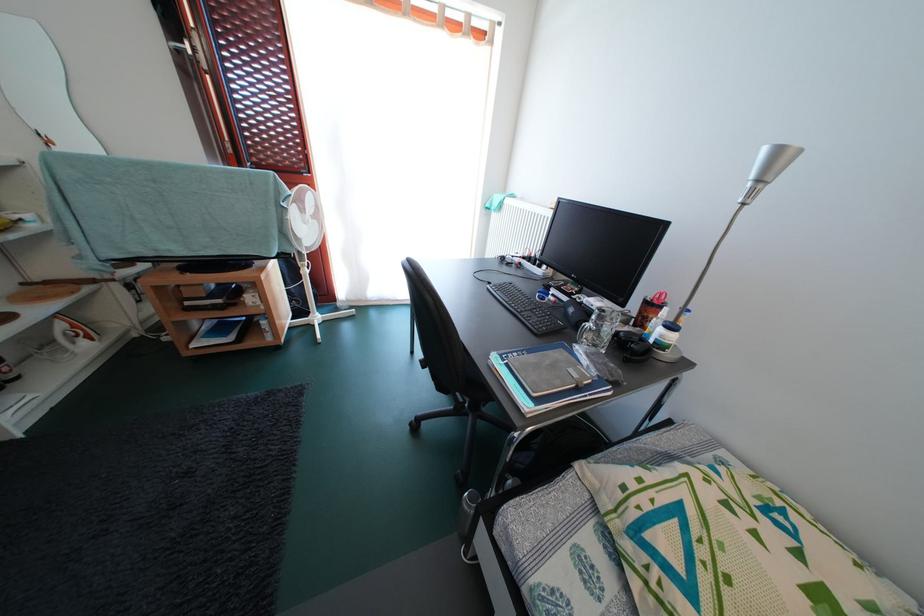
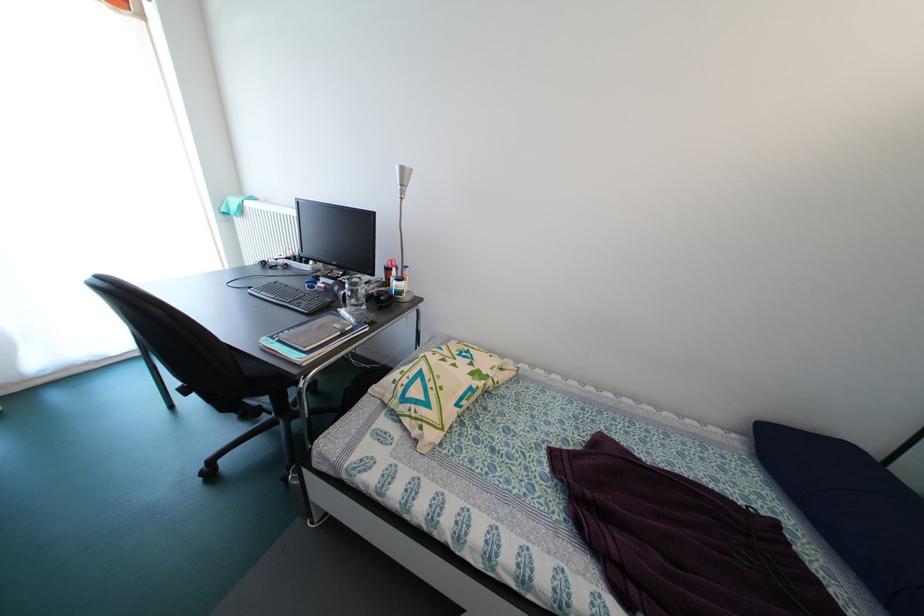
In the second image, find the point that corresponds to point 561,371 in the first image.

(327, 331)